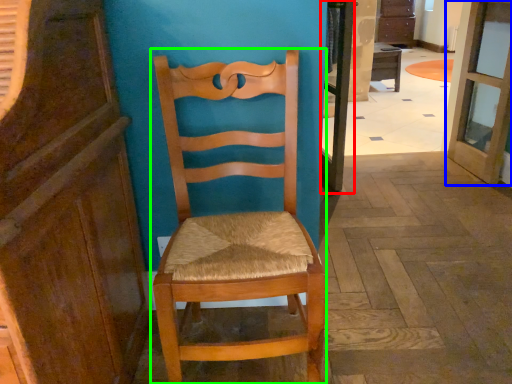
Question: Which is nearer to the screen door (highlighted by a red box)? door (highlighted by a blue box) or chair (highlighted by a green box).

Choices:
 (A) door
 (B) chair

Answer: (A)